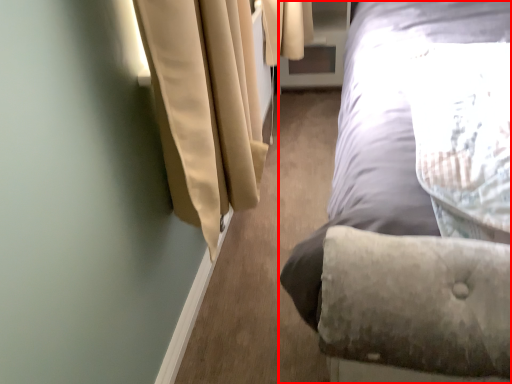
Question: Observing the image, what is the correct spatial positioning of bed (annotated by the red box) in reference to screen door?

Choices:
 (A) right
 (B) left

Answer: (A)